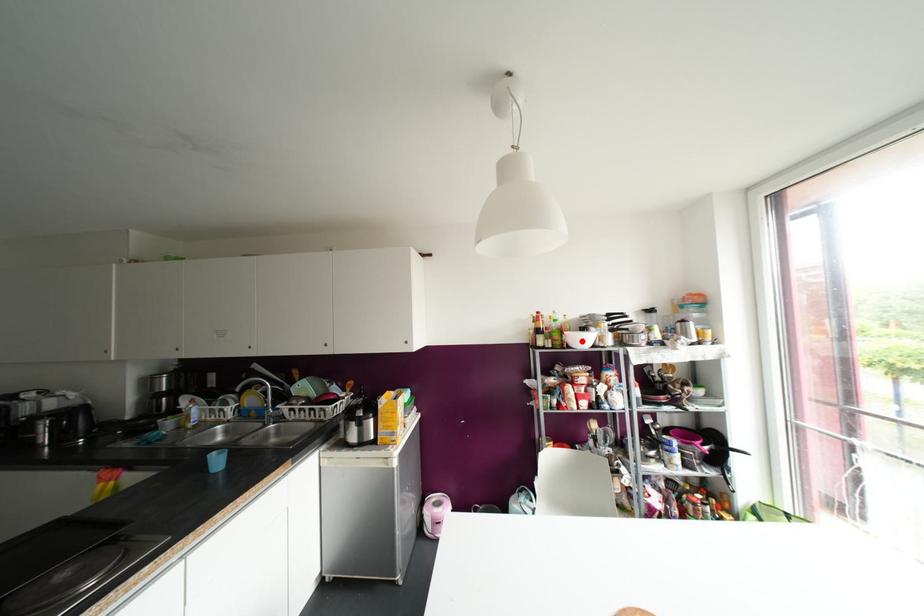
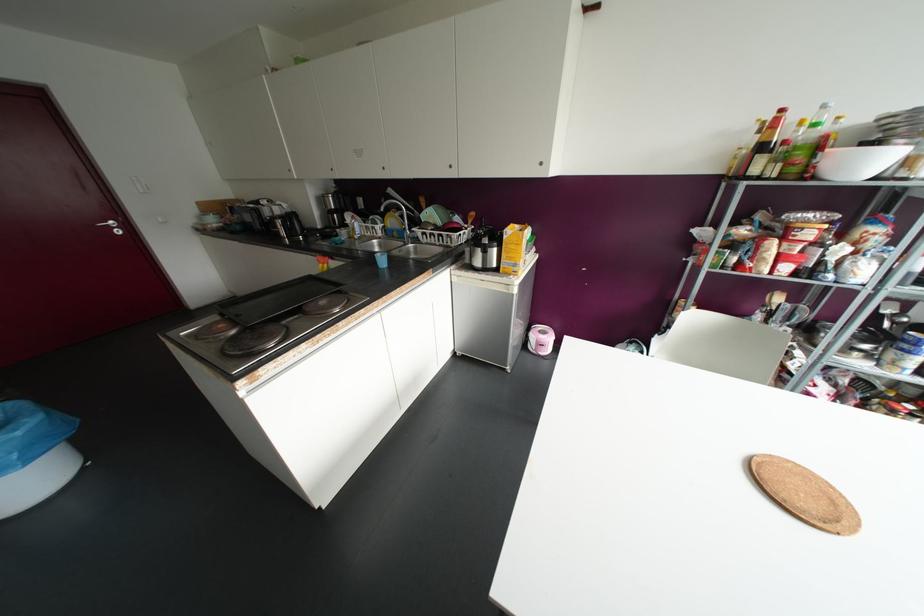
Locate, in the second image, the point that corresponds to the highlighted location in the first image.

(861, 164)